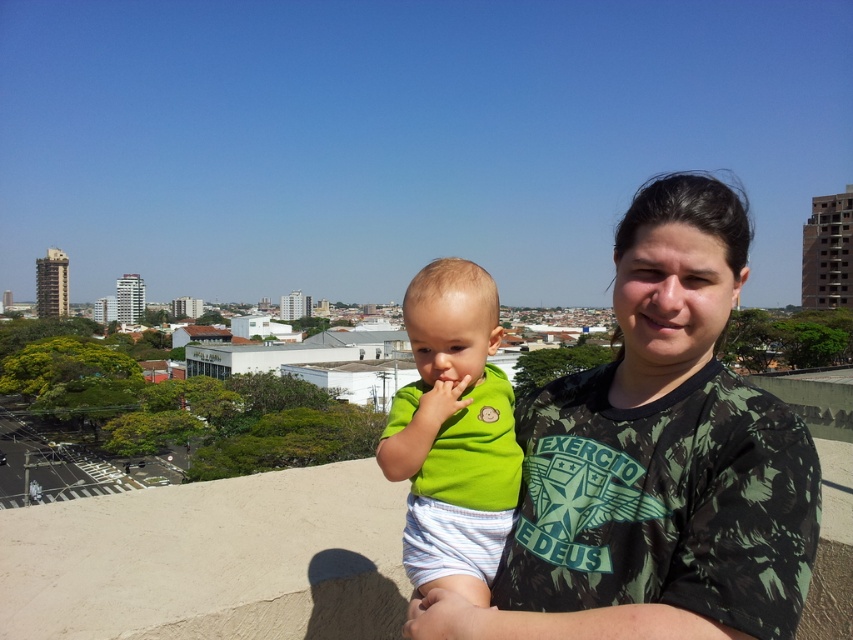
Does green camouflage shirt at center have a smaller size compared to green matte shirt at center?

No.

Is point (691, 204) farther from viewer compared to point (492, 480)?

No, (691, 204) is closer to viewer.

Locate an element on the screen. green camouflage shirt at center is located at coordinates (666, 445).